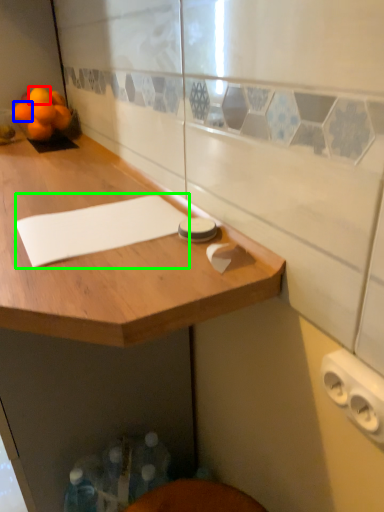
Question: Which object is the farthest from orange (highlighted by a red box)? Choose among these: orange (highlighted by a blue box) or notepad (highlighted by a green box).

Choices:
 (A) orange
 (B) notepad

Answer: (B)